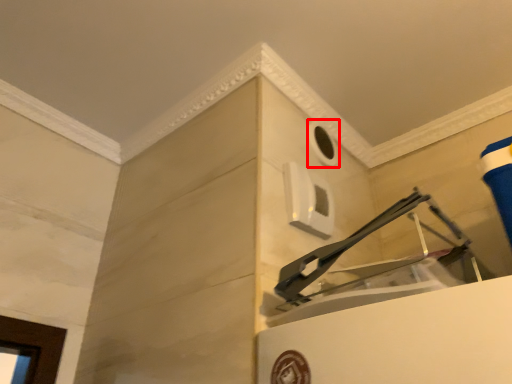
Question: From the image's perspective, what is the correct spatial positioning of hole (annotated by the red box) in reference to window?

Choices:
 (A) below
 (B) above

Answer: (B)